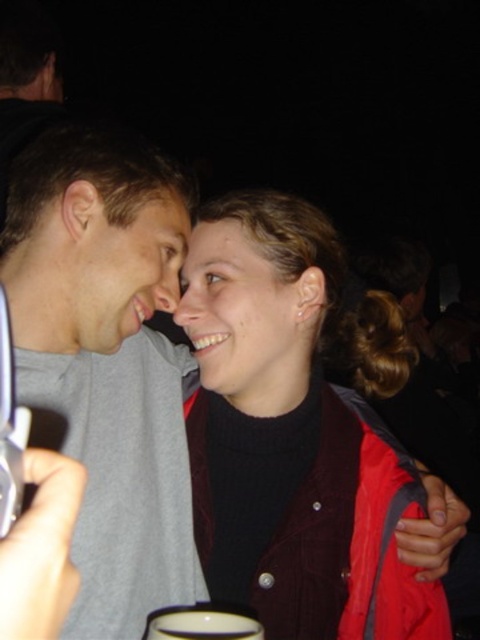
You are a photographer adjusting lighting for a portrait. The scene has a maroon corduroy jacket at center and a matte black face at center. Which object would require more light to ensure proper exposure, considering their sizes?

The maroon corduroy jacket at center has a larger size compared to the matte black face at center, so it would require more light to ensure proper exposure.

You are a photographer trying to capture the perfect shot of the couple in the scene. You notice two points marked in the image. The first point is at coordinates point (328, 445) and the second is at point (226, 275). Which point is closer to the background?

Point (328, 445) is behind point (226, 275), so the point closer to the background is point (328, 445).

Based on the photo, you are a photographer adjusting the lighting for a portrait. The subject is wearing a maroon corduroy jacket at center. You need to place a spotlight at point [288,436] to highlight the jacket. Is the spotlight positioned correctly?

Yes, the spotlight is correctly positioned at point [288,436] because the maroon corduroy jacket at center is located at that exact point.